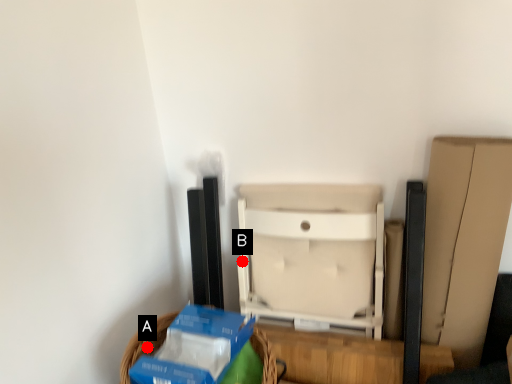
Question: Two points are circled on the image, labeled by A and B beside each circle. Which point is closer to the camera?

Choices:
 (A) A is closer
 (B) B is closer

Answer: (A)